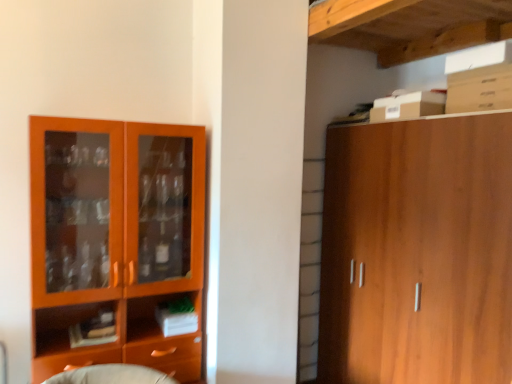
Question: Is wooden cabinet at right wider or thinner than orange wood cabinet at left?

Choices:
 (A) thin
 (B) wide

Answer: (B)

Question: From the image's perspective, is wooden cabinet at right above or below orange wood cabinet at left?

Choices:
 (A) below
 (B) above

Answer: (A)

Question: Which object is the closest to the white cardboard box at upper right?

Choices:
 (A) wooden cabinet at right
 (B) orange wood cabinet at left

Answer: (A)

Question: Considering the real-world distances, which object is closest to the white cardboard box at upper right?

Choices:
 (A) orange wood cabinet at left
 (B) wooden cabinet at right

Answer: (B)